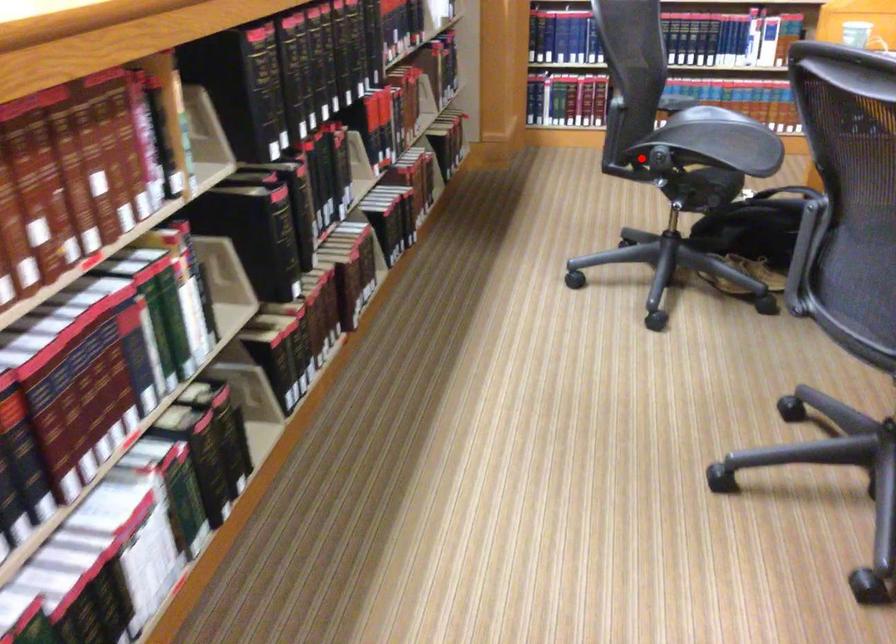
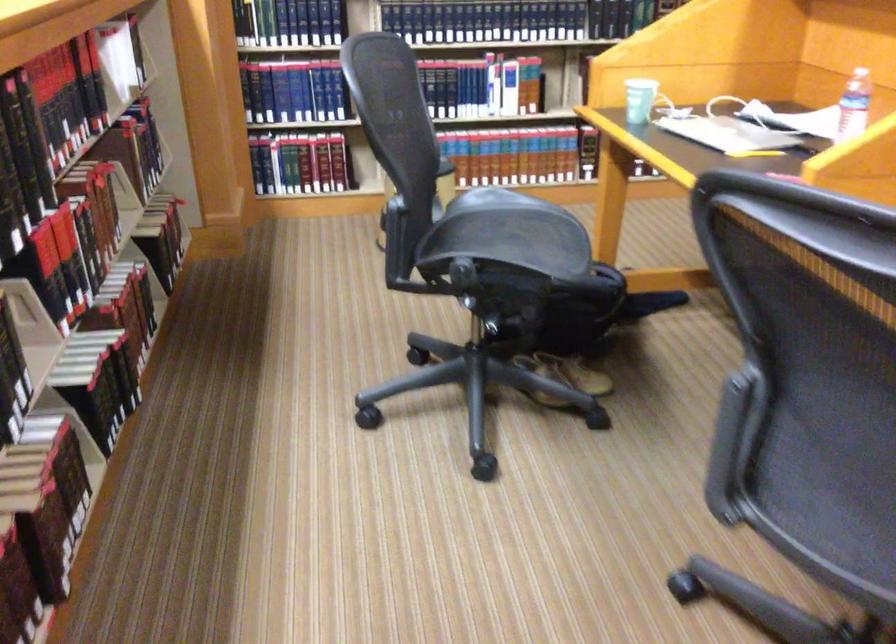
Where in the second image is the point corresponding to the highlighted location from the first image?

(433, 272)